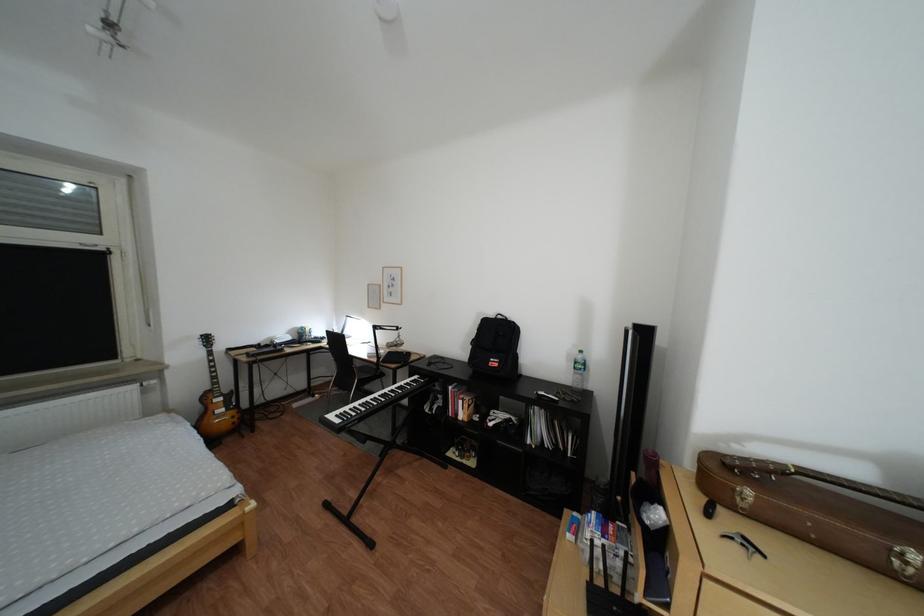
You are a GUI agent. You are given a task and a screenshot of the screen. Output one action in this format:
    pyautogui.click(x=<x>, y=<y>)
    Task: Click on the guitar case handle
    The height and width of the screenshot is (616, 924).
    Given the screenshot: What is the action you would take?
    pyautogui.click(x=744, y=496)